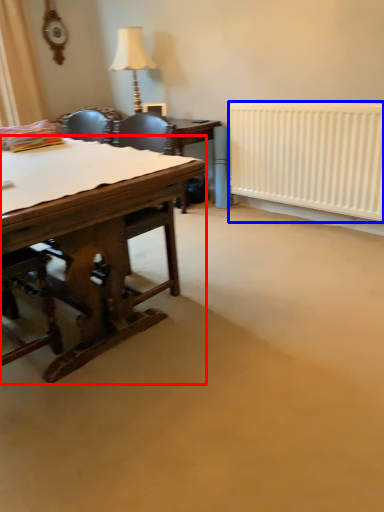
Question: Which of the following is the farthest to the observer, desk (highlighted by a red box) or radiator (highlighted by a blue box)?

Choices:
 (A) desk
 (B) radiator

Answer: (B)